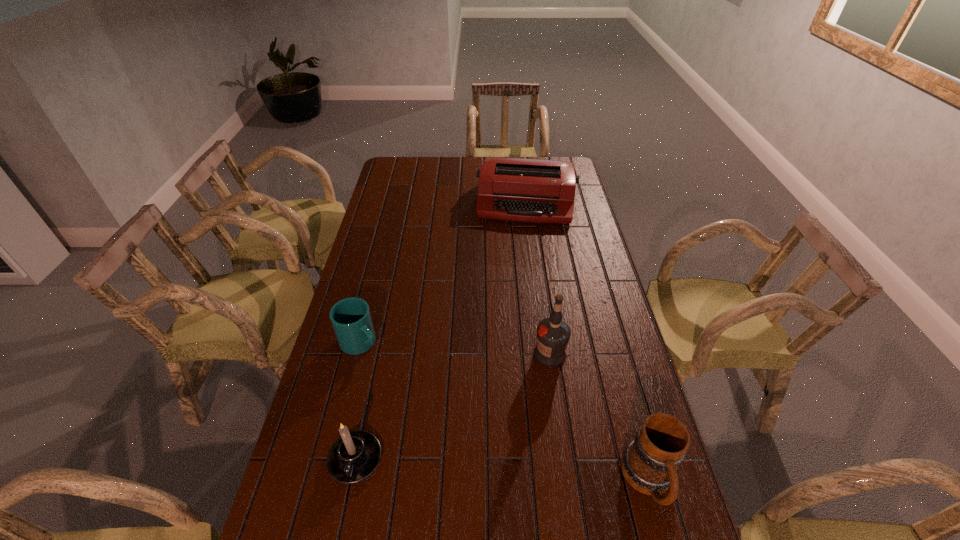
At what (x,y) coordinates should I click in order to perform the action: click on vacant space on the desktop that is between the candle holder and the mug and is positioned on the front label of the vodka. Please return your answer as a coordinate pair (x, y). Looking at the image, I should click on (472, 468).

This screenshot has height=540, width=960. What are the coordinates of `free spot on the desktop that is between the candle holder and the mug and is positioned on the handle side of the cup` in the screenshot? It's located at (524, 472).

Locate an element on the screen. free spot on the desktop that is between the candle holder and the mug and is positioned on the typing side of the farthest object is located at coordinates (507, 470).